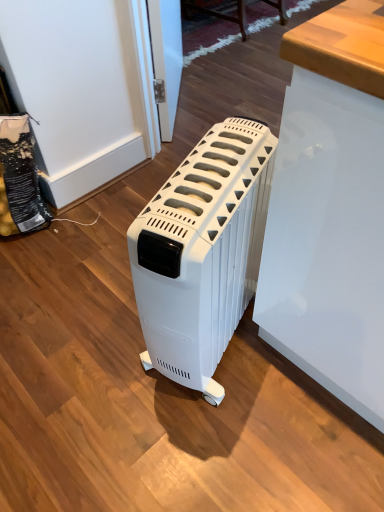
Identify the location of vacant position to the left of white plastic radiator at center. (96, 348).